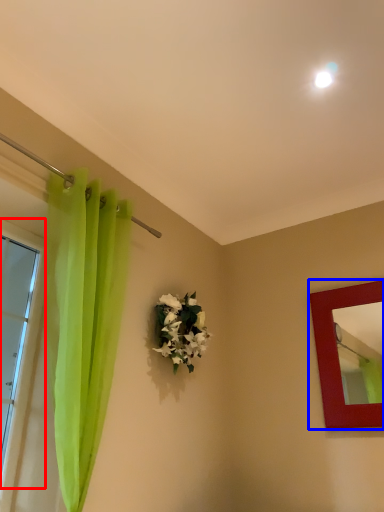
Question: Which of the following is the closest to the observer, window (highlighted by a red box) or picture frame (highlighted by a blue box)?

Choices:
 (A) window
 (B) picture frame

Answer: (A)